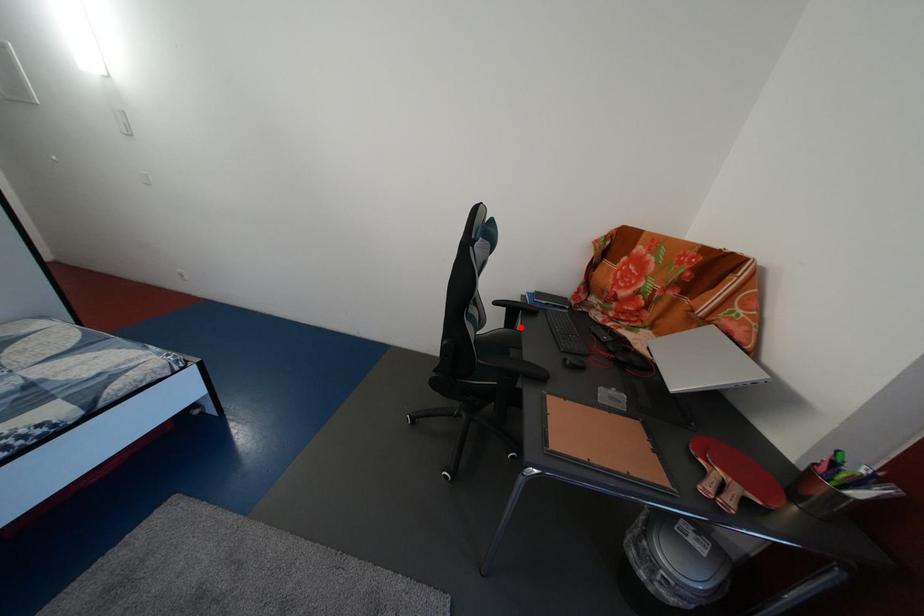
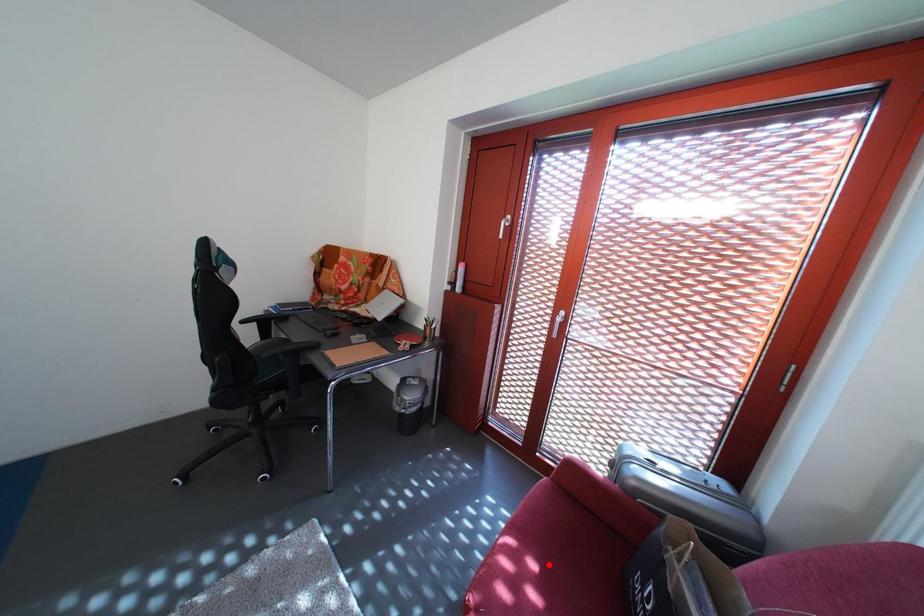
I am providing you with two images of the same scene from different viewpoints. A red point is marked on the first image and another point is marked on the second image. Is the marked point in image1 the same physical position as the marked point in image2?

No